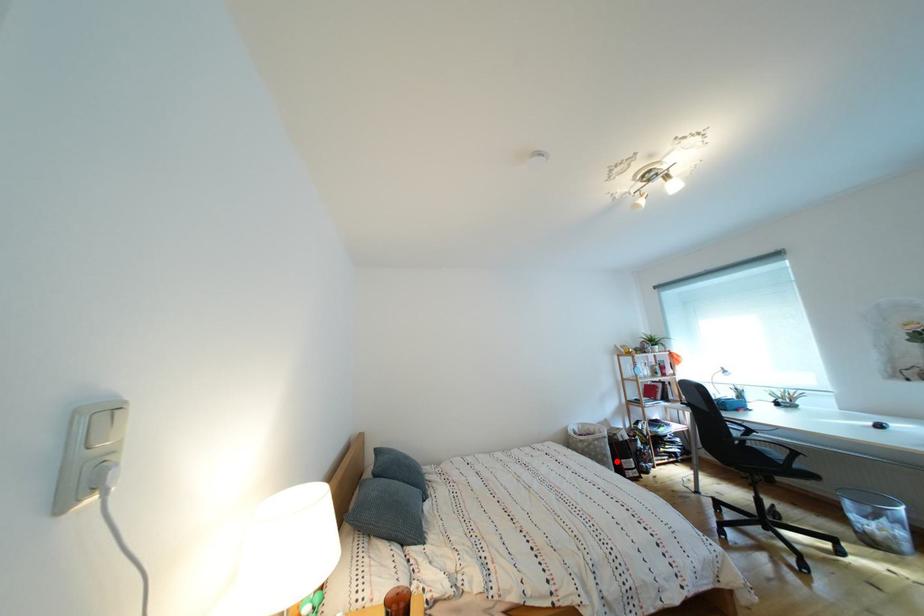
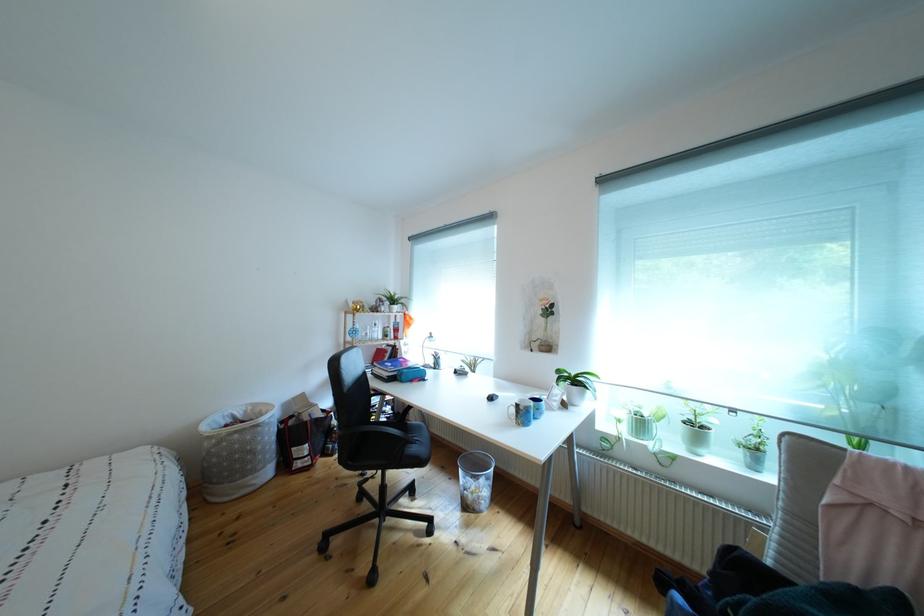
Question: I am providing you with two images of the same scene from different viewpoints. In image1, a red point is highlighted. Considering the same 3D point in image2, which of the following is correct?

Choices:
 (A) It is closer
 (B) It is farther

Answer: (A)